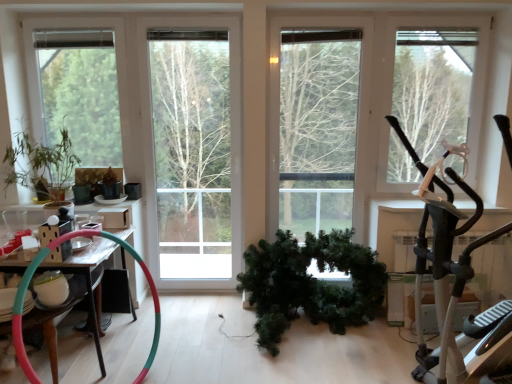
Question: Would you say wooden table at left is inside or outside green matte tree at center, the 2th tree in the left-to-right sequence?

Choices:
 (A) outside
 (B) inside

Answer: (A)

Question: Does point (53, 352) appear closer or farther from the camera than point (174, 100)?

Choices:
 (A) farther
 (B) closer

Answer: (B)

Question: Estimate the real-world distances between objects in this image. Which object is farther from the green matte tree at right, positioned as the third tree in left-to-right order?

Choices:
 (A) green matte tree at center, the 2th tree in the left-to-right sequence
 (B) wooden table at left
 (C) metallic gray stationary bicycle at right
 (D) green matte wreath at center, which is counted as the 2th houseplant, starting from the left
 (E) green matte plant at left, which is the third tree in right-to-left order

Answer: (B)

Question: Considering the real-world distances, which object is farthest from the wooden table at left?

Choices:
 (A) green matte plant at left, acting as the first tree starting from the left
 (B) green matte wreath at center, the 1th houseplant in the right-to-left sequence
 (C) green matte tree at right, which is the first tree from right to left
 (D) green matte tree at center, the 2th tree in the left-to-right sequence
 (E) metallic gray stationary bicycle at right

Answer: (C)